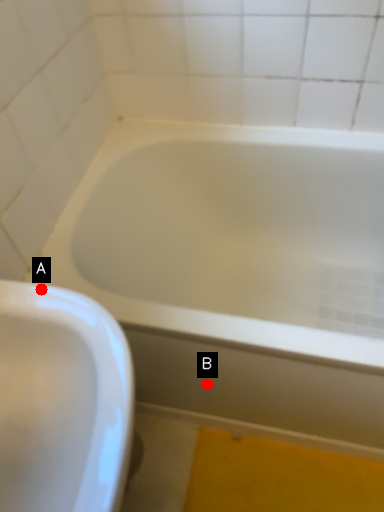
Question: Two points are circled on the image, labeled by A and B beside each circle. Which point appears farthest from the camera in this image?

Choices:
 (A) A is further
 (B) B is further

Answer: (B)